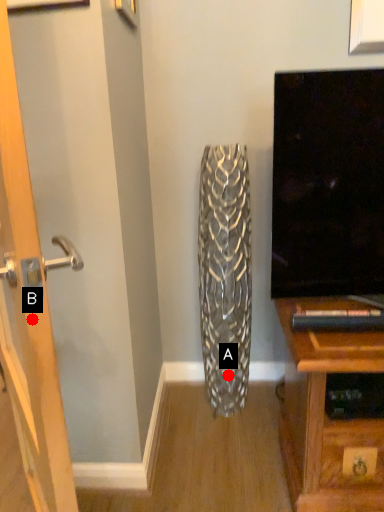
Question: Two points are circled on the image, labeled by A and B beside each circle. Which point is closer to the camera?

Choices:
 (A) A is closer
 (B) B is closer

Answer: (B)